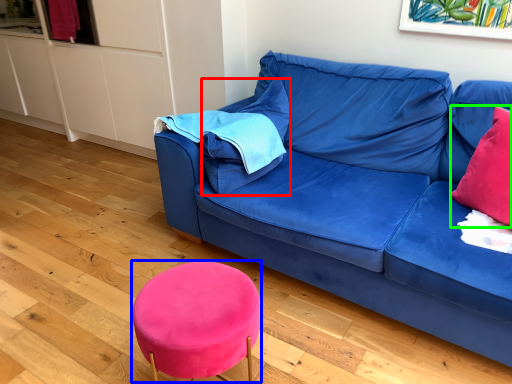
Question: Which object is positioned farthest from pillow (highlighted by a red box)? Select from bar stool (highlighted by a blue box) and throw pillow (highlighted by a green box).

Choices:
 (A) bar stool
 (B) throw pillow

Answer: (B)